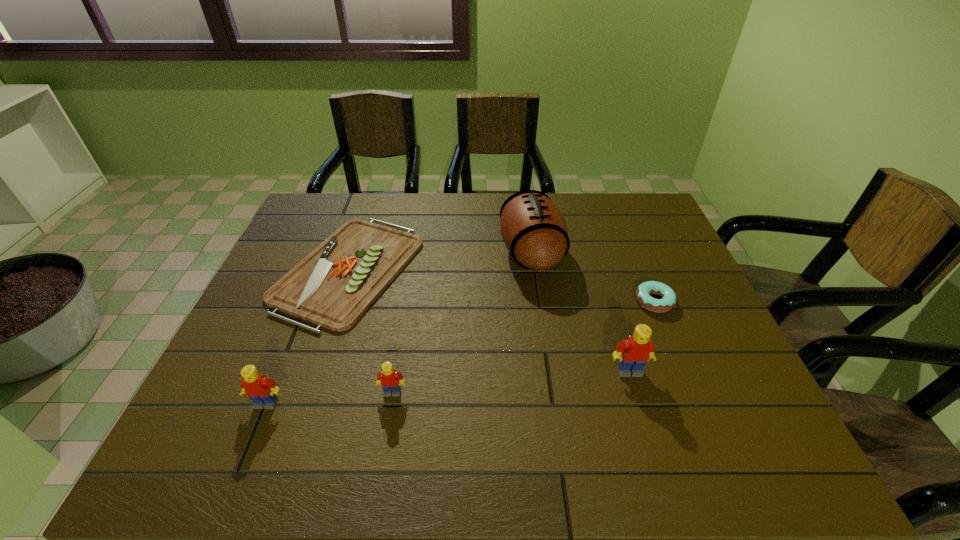
Where is `vacant space at the far edge`? Image resolution: width=960 pixels, height=540 pixels. vacant space at the far edge is located at coordinates (578, 194).

At what (x,y) coordinates should I click in order to perform the action: click on blank area at the near edge. Please return your answer as a coordinate pair (x, y). The height and width of the screenshot is (540, 960). Looking at the image, I should click on (299, 385).

In order to click on free region at the right edge of the desktop in this screenshot , I will do `click(732, 375)`.

In the image, there is a desktop. At what (x,y) coordinates should I click in order to perform the action: click on free space at the near right corner. Please return your answer as a coordinate pair (x, y). The height and width of the screenshot is (540, 960). Looking at the image, I should click on (698, 407).

The width and height of the screenshot is (960, 540). I want to click on vacant space in between the second nearest object and the nearest Lego, so click(329, 398).

You are a GUI agent. You are given a task and a screenshot of the screen. Output one action in this format:
    pyautogui.click(x=<x>, y=<y>)
    Task: Click on the free spot between the doughnut and the fourth object from left to right
    Image resolution: width=960 pixels, height=540 pixels.
    Given the screenshot: What is the action you would take?
    pyautogui.click(x=592, y=276)

The height and width of the screenshot is (540, 960). In order to click on vacant region between the fourth object from left to right and the rightmost Lego in this screenshot , I will do `click(580, 312)`.

Locate an element on the screen. free point between the second tallest Lego and the football (American) is located at coordinates (398, 328).

Image resolution: width=960 pixels, height=540 pixels. I want to click on vacant area between the chopping board and the third object from right to left, so click(x=441, y=261).

I want to click on free space between the second Lego from left to right and the farthest Lego, so click(511, 382).